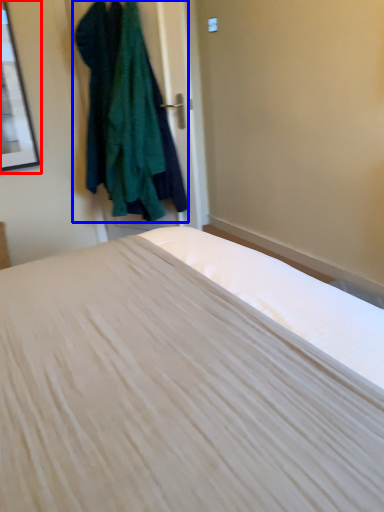
Question: Which of the following is the farthest to the observer, picture frame (highlighted by a red box) or clothing (highlighted by a blue box)?

Choices:
 (A) picture frame
 (B) clothing

Answer: (A)